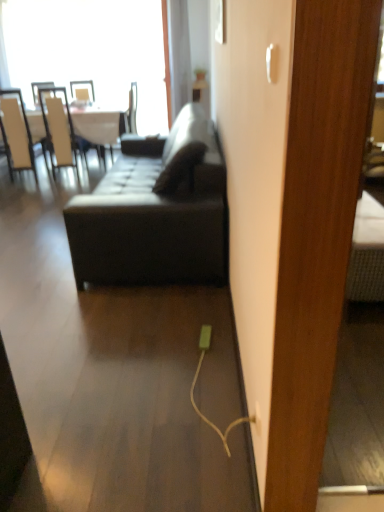
Question: In the image, is matte black couch at center positioned in front of or behind white leather chair at left, the 2th chair in the left-to-right sequence?

Choices:
 (A) behind
 (B) front

Answer: (B)

Question: Visually, is matte black couch at center positioned to the left or to the right of white leather chair at left, the 2th chair in the left-to-right sequence?

Choices:
 (A) right
 (B) left

Answer: (A)

Question: Estimate the real-world distances between objects in this image. Which object is closer to the white glossy table at upper left?

Choices:
 (A) matte black couch at center
 (B) white leather chair at left, the 2th chair in the left-to-right sequence
 (C) transparent glass window at upper left
 (D) white plastic electric outlet at lower center
 (E) white leather chair at left, which ranks as the 2th chair in right-to-left order

Answer: (B)

Question: Estimate the real-world distances between objects in this image. Which object is closer to the white glossy table at upper left?

Choices:
 (A) white leather chair at left, which appears as the 1th chair when viewed from the left
 (B) white plastic electric outlet at lower center
 (C) matte black couch at center
 (D) transparent glass window at upper left
 (E) white leather chair at left, the 1th chair viewed from the right

Answer: (E)